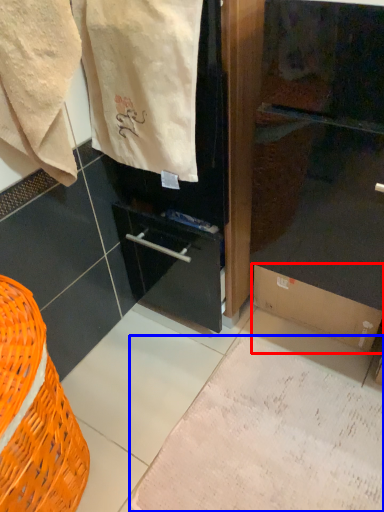
Question: Which point is further to the camera, cardboard box (highlighted by a red box) or parchment (highlighted by a blue box)?

Choices:
 (A) cardboard box
 (B) parchment

Answer: (A)